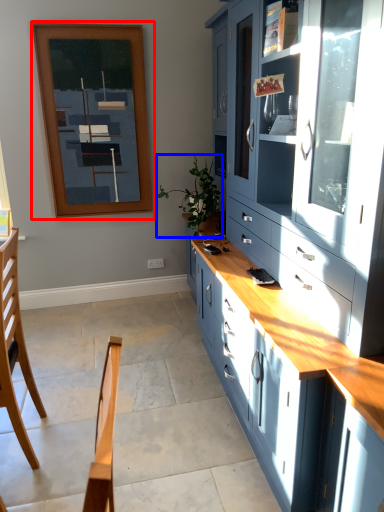
Question: Which of the following is the closest to the observer, picture frame (highlighted by a red box) or plant (highlighted by a blue box)?

Choices:
 (A) picture frame
 (B) plant

Answer: (B)